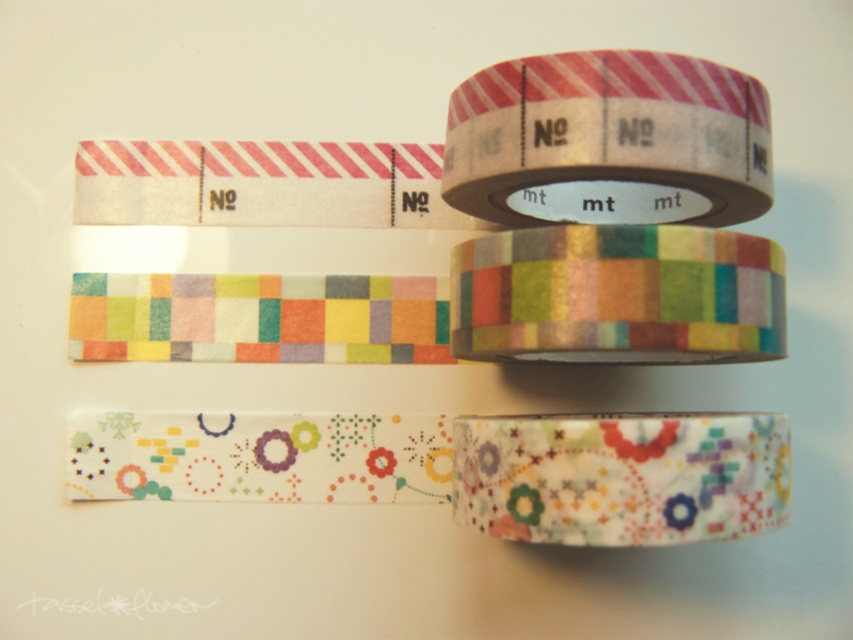
You are standing in front of the washi tape display. There is a point at coordinates point (498, 86). Can you reach this point with your hand?

The point (498, 86) is 3.44 feet away from you. Since this distance is within typical human arm reach, you can likely extend your hand to touch it.